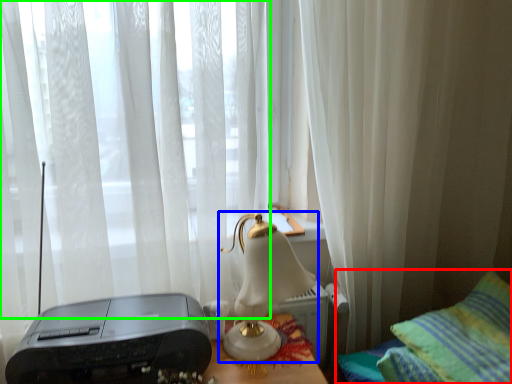
Question: Which object is the farthest from furniture (highlighted by a red box)? Choose among these: lamp (highlighted by a blue box) or curtain (highlighted by a green box).

Choices:
 (A) lamp
 (B) curtain

Answer: (B)